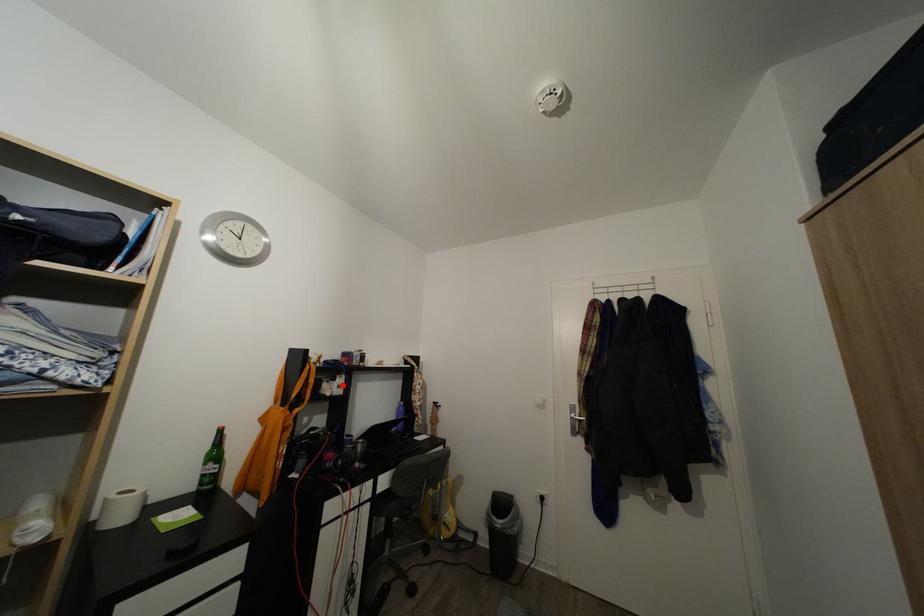
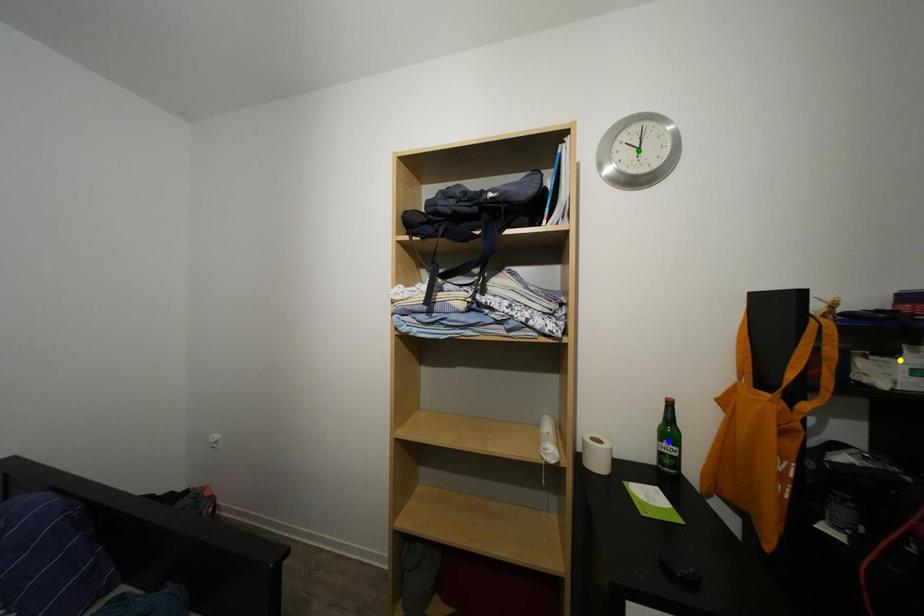
Question: I am providing you with two images of the same scene from different viewpoints. A red point is marked on the first image. You are given multiple points on the second image. Which spot in image 2 lines up with the point in image 1?

Choices:
 (A) blue point
 (B) green point
 (C) yellow point

Answer: (C)